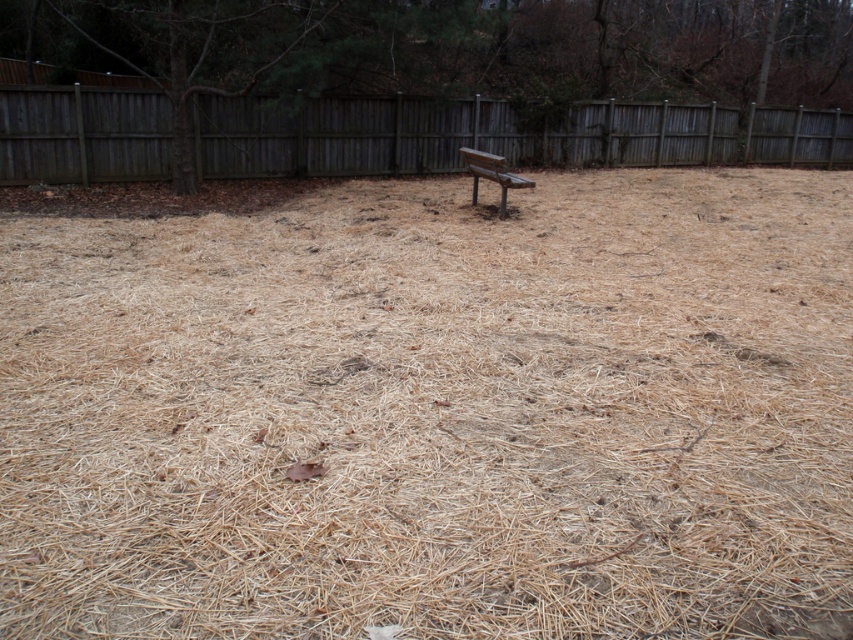
The width and height of the screenshot is (853, 640). Describe the element at coordinates (433, 410) in the screenshot. I see `brown straw at center` at that location.

Between point (822, 548) and point (473, 193), which one is positioned behind?

The point (473, 193) is behind.

At what (x,y) coordinates should I click in order to perform the action: click on brown straw at center. Please return your answer as a coordinate pair (x, y). The height and width of the screenshot is (640, 853). Looking at the image, I should click on (433, 410).

In the scene shown: Between brown straw at center and weathered wood fence at upper center, which one is positioned higher?

weathered wood fence at upper center

Does brown straw at center have a larger size compared to weathered wood fence at upper center?

No, brown straw at center is not bigger than weathered wood fence at upper center.

Where is `brown straw at center`? The height and width of the screenshot is (640, 853). brown straw at center is located at coordinates (433, 410).

Can you confirm if weathered wood fence at upper center is wider than wooden bench at center?

Yes, weathered wood fence at upper center is wider than wooden bench at center.

Is point (340, 164) behind point (498, 180)?

Yes, it is.

Locate an element on the screen. The height and width of the screenshot is (640, 853). weathered wood fence at upper center is located at coordinates (497, 134).